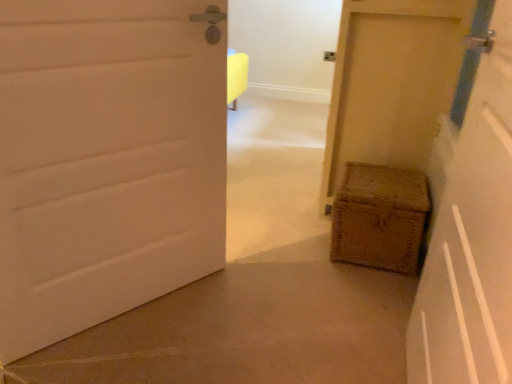
Question: Would you say woven wood chest at lower right, acting as the third door starting from the left, contains white matte door at left, which is the 3th door from right to left?

Choices:
 (A) no
 (B) yes

Answer: (A)

Question: From the image's perspective, is woven wood chest at lower right, which ranks as the 1th door in right-to-left order, beneath white matte door at left, the 1th door when ordered from left to right?

Choices:
 (A) yes
 (B) no

Answer: (B)

Question: Does woven wood chest at lower right, which ranks as the 1th door in right-to-left order, have a lesser width compared to white matte door at left, the 1th door when ordered from left to right?

Choices:
 (A) no
 (B) yes

Answer: (A)

Question: Is the position of woven wood chest at lower right, which ranks as the 1th door in right-to-left order, more distant than that of white matte door at left, which is the 3th door from right to left?

Choices:
 (A) yes
 (B) no

Answer: (A)

Question: Can you confirm if woven wood chest at lower right, which ranks as the 1th door in right-to-left order, is bigger than white matte door at left, the 1th door when ordered from left to right?

Choices:
 (A) no
 (B) yes

Answer: (B)

Question: From a real-world perspective, is woven wood chest at lower right, acting as the third door starting from the left, positioned above or below woven brown basket at lower right?

Choices:
 (A) below
 (B) above

Answer: (B)

Question: From the image's perspective, is woven wood chest at lower right, which ranks as the 1th door in right-to-left order, located above or below woven brown basket at lower right?

Choices:
 (A) above
 (B) below

Answer: (A)

Question: Is point (419, 46) closer or farther from the camera than point (369, 238)?

Choices:
 (A) farther
 (B) closer

Answer: (A)

Question: Is woven wood chest at lower right, which ranks as the 1th door in right-to-left order, situated inside woven brown basket at lower right or outside?

Choices:
 (A) outside
 (B) inside

Answer: (A)

Question: Considering their positions, is white matte door at left, the 1th door when ordered from left to right, located in front of or behind woven brown basket at lower right?

Choices:
 (A) front
 (B) behind

Answer: (A)

Question: In the image, is white matte door at left, which is the 3th door from right to left, on the left side or the right side of woven brown basket at lower right?

Choices:
 (A) left
 (B) right

Answer: (A)

Question: Do you think white matte door at left, the 1th door when ordered from left to right, is within woven brown basket at lower right, or outside of it?

Choices:
 (A) inside
 (B) outside

Answer: (B)

Question: From a real-world perspective, is white matte door at left, the 1th door when ordered from left to right, positioned above or below woven brown basket at lower right?

Choices:
 (A) above
 (B) below

Answer: (A)

Question: Do you think matte yellow door at right, which is the second door from right to left, is within woven wood chest at lower right, acting as the third door starting from the left, or outside of it?

Choices:
 (A) inside
 (B) outside

Answer: (B)

Question: Is point (411, 317) positioned closer to the camera than point (419, 16)?

Choices:
 (A) farther
 (B) closer

Answer: (B)